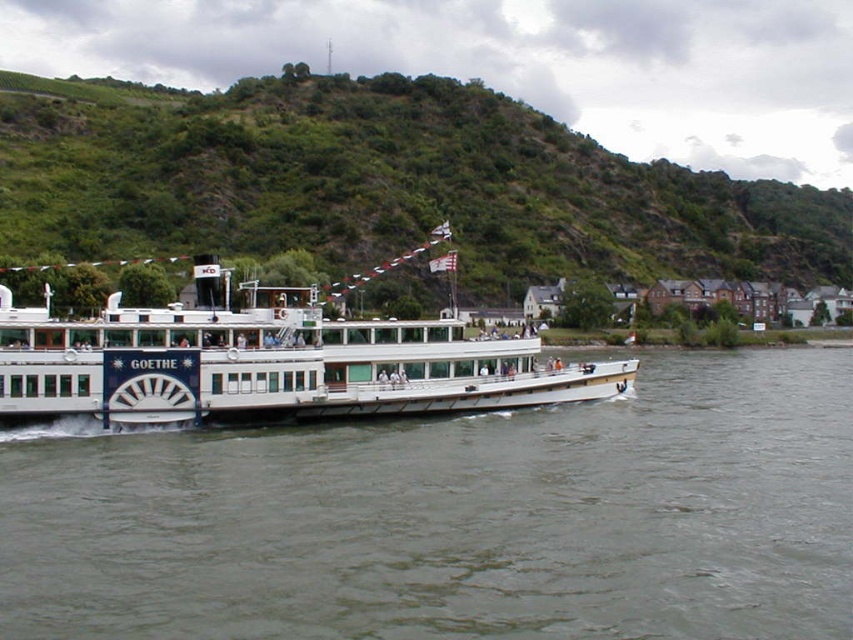
Which is in front, point (566, 196) or point (517, 406)?

Point (517, 406) is in front.

Which is more to the right, green grassy hillside at upper center or white matte cruise ship at center?

From the viewer's perspective, green grassy hillside at upper center appears more on the right side.

Image resolution: width=853 pixels, height=640 pixels. I want to click on green grassy hillside at upper center, so click(x=381, y=184).

Who is positioned more to the right, gray water at center or white matte cruise ship at center?

From the viewer's perspective, gray water at center appears more on the right side.

Can you confirm if gray water at center is thinner than white matte cruise ship at center?

Yes, gray water at center is thinner than white matte cruise ship at center.

Does point (32, 577) come closer to viewer compared to point (67, 385)?

That is True.

Where is `gray water at center`? gray water at center is located at coordinates (454, 518).

Is gray water at center taller than green grassy hillside at upper center?

Incorrect, gray water at center's height is not larger of green grassy hillside at upper center's.

Who is more distant from viewer, (654, 364) or (287, 163)?

The point (287, 163) is behind.

The height and width of the screenshot is (640, 853). Describe the element at coordinates (454, 518) in the screenshot. I see `gray water at center` at that location.

I want to click on gray water at center, so click(454, 518).